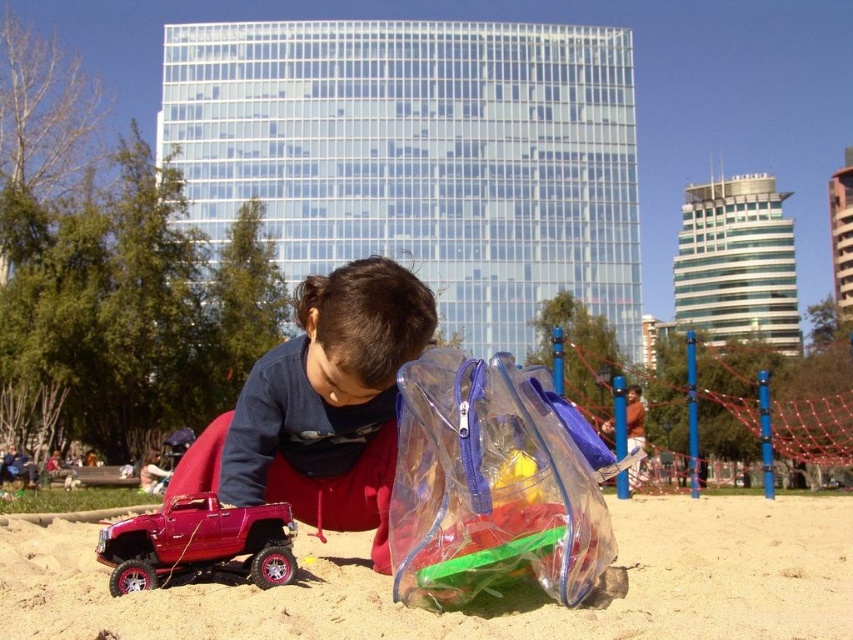
You are a parent trying to organize your child playing in the sandbox. The child has a transparent plastic bag at center and a dark blue fabric at center. You want to place both items in a storage box that is 6 feet wide. Can you fit both items side by side in the box?

The transparent plastic bag at center and dark blue fabric at center are 6.32 feet apart from each other. Since the storage box is only 6 feet wide, the combined width of both items exceeds the box width by 0.32 feet, so they cannot fit side by side.

You are standing in the park and want to take a photo of both the child playing with the red toy truck and the glass skyscraper in the background. Which point, point 1 at coordinates (772, 548) or point 2 at (432, 452), should you focus on to ensure both the child and the skyscraper are in clear view?

You should focus on point 1 at coordinates (772, 548) because it is closer to the viewer than point 2 at (432, 452), allowing both the child in the foreground and the skyscraper in the background to be in focus.